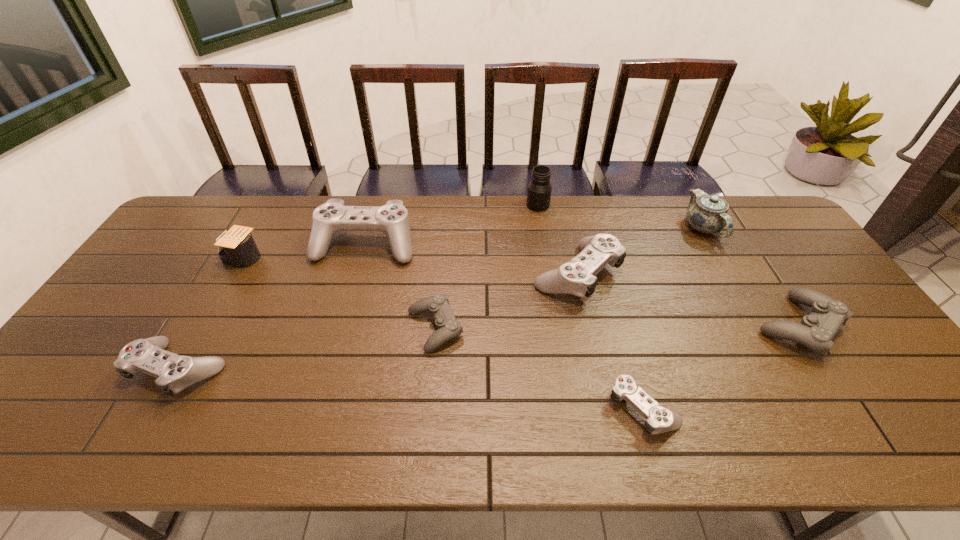
This screenshot has width=960, height=540. In order to click on vacant region at the far left corner in this screenshot , I will do `click(232, 207)`.

This screenshot has height=540, width=960. Find the location of `vacant space at the far right corner of the desktop`. vacant space at the far right corner of the desktop is located at coordinates (765, 218).

Identify the location of blank region between the left gray control and the tallest control. This screenshot has height=540, width=960. (400, 286).

I want to click on unoccupied position between the second tallest control and the fifth control from right to left, so click(470, 259).

Where is `free spot between the chinaware and the jar`? free spot between the chinaware and the jar is located at coordinates (620, 217).

This screenshot has width=960, height=540. Identify the location of blank region between the smallest white control and the chinaware. (672, 318).

The image size is (960, 540). What are the coordinates of `empty location between the chinaware and the seventh object from right to left` in the screenshot? It's located at (534, 237).

The image size is (960, 540). Find the location of `free spot between the chinaware and the second biggest white control`. free spot between the chinaware and the second biggest white control is located at coordinates (639, 251).

Where is `free space between the seventh object from right to left and the calculator`? The width and height of the screenshot is (960, 540). free space between the seventh object from right to left and the calculator is located at coordinates (302, 252).

You are a GUI agent. You are given a task and a screenshot of the screen. Output one action in this format:
    pyautogui.click(x=<x>, y=<y>)
    Task: Click on the empty location between the second biggest white control and the third white control from right to left
    This screenshot has height=540, width=960.
    Given the screenshot: What is the action you would take?
    pyautogui.click(x=470, y=259)